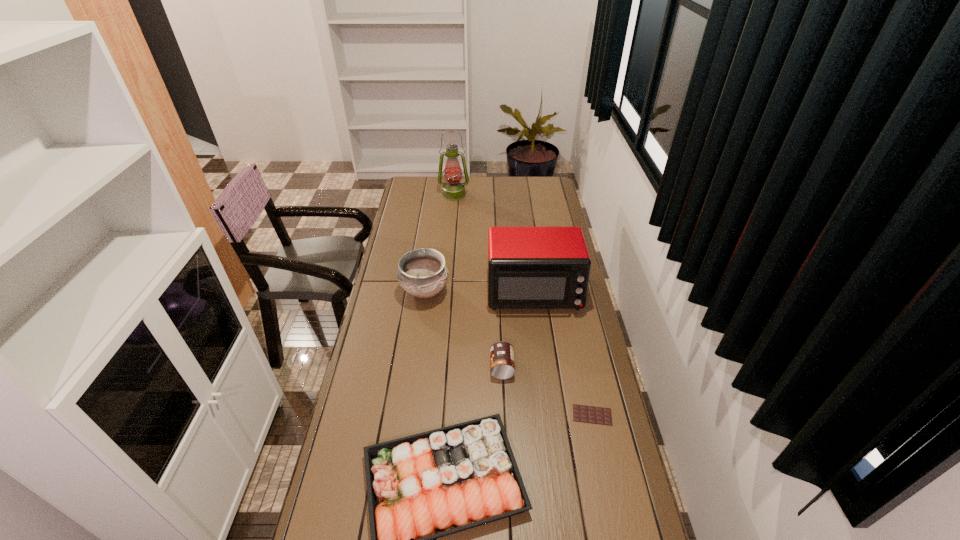
Locate an element on the screen. The width and height of the screenshot is (960, 540). the fifth closest object relative to the shortest object is located at coordinates (453, 190).

Locate an element on the screen. vacant area in the image that satisfies the following two spatial constraints: 1. on the back side of the shortest object; 2. on the front label of the third shortest object is located at coordinates (582, 367).

Identify the location of free space that satisfies the following two spatial constraints: 1. on the front side of the tallest object; 2. on the right side of the shortest object. The width and height of the screenshot is (960, 540). (435, 415).

Image resolution: width=960 pixels, height=540 pixels. What are the coordinates of `vacant space that satisfies the following two spatial constraints: 1. on the front label of the can; 2. on the left side of the shortest object` in the screenshot? It's located at (504, 415).

Locate an element on the screen. The width and height of the screenshot is (960, 540). vacant space that satisfies the following two spatial constraints: 1. on the front-facing side of the shortest object; 2. on the left side of the fifth shortest object is located at coordinates (550, 415).

Identify the location of free point that satisfies the following two spatial constraints: 1. on the front-facing side of the second tallest object; 2. on the right side of the chocolate bar. Image resolution: width=960 pixels, height=540 pixels. (550, 415).